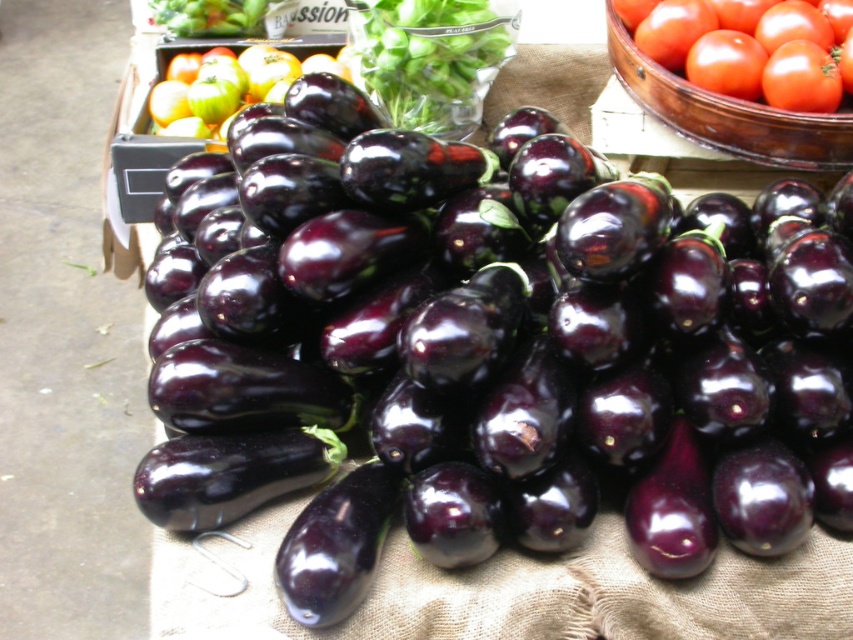
You are a customer at the market and want to buy both the shiny purple eggplant at center and the shiny green apples at upper left. You need to know which one is taller to fit them in your bag. Which one is taller?

The shiny purple eggplant at center is much taller than the shiny green apples at upper left, so it will take up more vertical space in your bag.